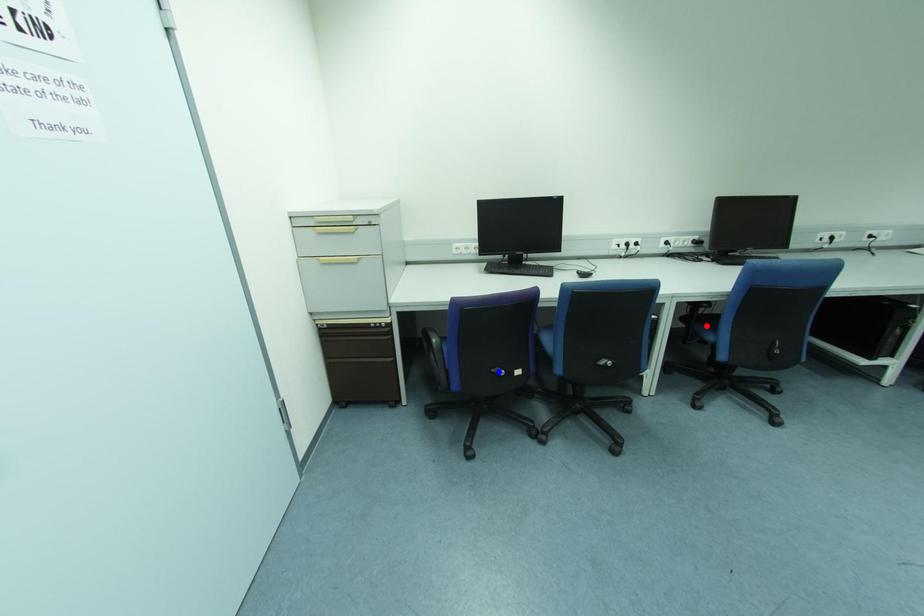
Question: Which of the two points in the image is closer to the camera?

Choices:
 (A) Blue point is closer.
 (B) Red point is closer.

Answer: (A)